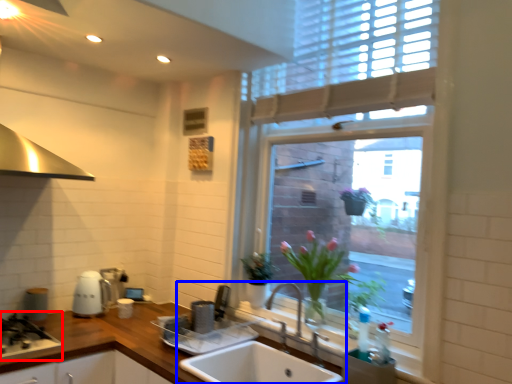
Question: Which of the following is the closest to the observer, gas stove (highlighted by a red box) or sink (highlighted by a blue box)?

Choices:
 (A) gas stove
 (B) sink

Answer: (B)